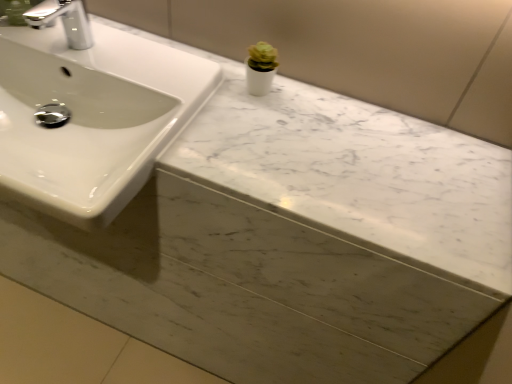
The height and width of the screenshot is (384, 512). Identify the location of silver metallic faucet at upper left. (63, 20).

The height and width of the screenshot is (384, 512). What are the coordinates of `white glossy sink at upper left` in the screenshot? It's located at 90,112.

Is silver metallic faucet at upper left far away from white glossy sink at upper left?

No, silver metallic faucet at upper left is in close proximity to white glossy sink at upper left.

Can you tell me how much silver metallic faucet at upper left and white glossy sink at upper left differ in facing direction?

There is a 1.87-degree angle between the facing directions of silver metallic faucet at upper left and white glossy sink at upper left.

Is silver metallic faucet at upper left positioned behind white glossy sink at upper left?

Yes, silver metallic faucet at upper left is behind white glossy sink at upper left.

Is white marble counter top at upper center next to silver metallic faucet at upper left?

white marble counter top at upper center and silver metallic faucet at upper left are clearly separated.

Is silver metallic faucet at upper left completely or partially inside white marble counter top at upper center?

Actually, silver metallic faucet at upper left is outside white marble counter top at upper center.

Is white marble counter top at upper center wider than silver metallic faucet at upper left?

Yes, white marble counter top at upper center is wider than silver metallic faucet at upper left.

Which object is positioned more to the right, white marble counter top at upper center or silver metallic faucet at upper left?

Positioned to the right is white marble counter top at upper center.

Considering the positions of objects white glossy sink at upper left and white marble counter top at upper center in the image provided, who is more to the left, white glossy sink at upper left or white marble counter top at upper center?

white glossy sink at upper left.

How many degrees apart are the facing directions of white glossy sink at upper left and white marble counter top at upper center?

0.0496 degrees separate the facing orientations of white glossy sink at upper left and white marble counter top at upper center.

Is point (3, 159) in front of point (165, 152)?

Yes, it is in front of point (165, 152).

Is white glossy sink at upper left aimed at white marble counter top at upper center?

No.

From the image's perspective, is white marble counter top at upper center positioned above or below white glossy sink at upper left?

white marble counter top at upper center is situated lower than white glossy sink at upper left in the image.

At what (x,y) coordinates should I click in order to perform the action: click on counter top behind the white glossy sink at upper left. Please return your answer as a coordinate pair (x, y). The height and width of the screenshot is (384, 512). Looking at the image, I should click on (357, 175).

Which is closer to the camera, (484, 187) or (79, 107)?

The point (484, 187) is closer to the camera.

From the picture: Who is shorter, white marble counter top at upper center or white glossy sink at upper left?

Standing shorter between the two is white marble counter top at upper center.

Between silver metallic faucet at upper left and white marble counter top at upper center, which one has larger size?

white marble counter top at upper center.

Between point (31, 16) and point (263, 119), which one is positioned behind?

The point (31, 16) is more distant.

Is silver metallic faucet at upper left far from white marble counter top at upper center?

Actually, silver metallic faucet at upper left and white marble counter top at upper center are a little close together.

Is the surface of white glossy sink at upper left in direct contact with silver metallic faucet at upper left?

No, white glossy sink at upper left is not beside silver metallic faucet at upper left.

Is white glossy sink at upper left looking in the opposite direction of silver metallic faucet at upper left?

No, white glossy sink at upper left is not facing the opposite direction of silver metallic faucet at upper left.

Does white glossy sink at upper left have a lesser width compared to silver metallic faucet at upper left?

No, white glossy sink at upper left is not thinner than silver metallic faucet at upper left.

At what (x,y) coordinates should I click in order to perform the action: click on tap on the right of white glossy sink at upper left. Please return your answer as a coordinate pair (x, y). Looking at the image, I should click on (63, 20).

Where is `tap located above the white marble counter top at upper center (from the image's perspective)`? This screenshot has width=512, height=384. tap located above the white marble counter top at upper center (from the image's perspective) is located at coordinates (63, 20).

Based on their spatial positions, is white marble counter top at upper center or white glossy sink at upper left further from silver metallic faucet at upper left?

white marble counter top at upper center is positioned further to the anchor silver metallic faucet at upper left.

Based on their spatial positions, is white marble counter top at upper center or silver metallic faucet at upper left closer to white glossy sink at upper left?

silver metallic faucet at upper left is closer to white glossy sink at upper left.

Based on their spatial positions, is white glossy sink at upper left or silver metallic faucet at upper left closer to white marble counter top at upper center?

white glossy sink at upper left.

Looking at this image, looking at the image, which one is located further to white glossy sink at upper left, silver metallic faucet at upper left or white marble counter top at upper center?

Based on the image, white marble counter top at upper center appears to be further to white glossy sink at upper left.

From the image, which object appears to be nearer to white marble counter top at upper center, silver metallic faucet at upper left or white glossy sink at upper left?

white glossy sink at upper left lies closer to white marble counter top at upper center than the other object.

Estimate the real-world distances between objects in this image. Which object is closer to silver metallic faucet at upper left, white glossy sink at upper left or white marble counter top at upper center?

The object closer to silver metallic faucet at upper left is white glossy sink at upper left.

Find the location of a particular element. This screenshot has width=512, height=384. tap between white glossy sink at upper left and white marble counter top at upper center is located at coordinates (63, 20).